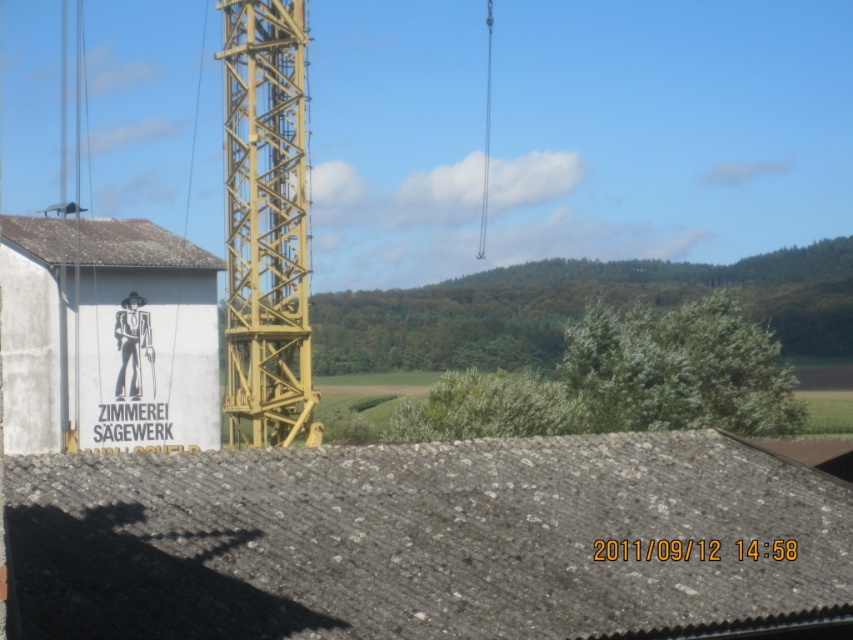
Which is below, gray slate roof at center or yellow metallic crane at center?

gray slate roof at center

Is point (166, 595) less distant than point (280, 122)?

Yes, it is in front of point (280, 122).

Locate an element on the screen. The width and height of the screenshot is (853, 640). gray slate roof at center is located at coordinates (428, 540).

Is white shingle roof at left taller than black matte figure at center?

No, white shingle roof at left is not taller than black matte figure at center.

Identify the location of white shingle roof at left. The image size is (853, 640). (103, 243).

Does yellow metallic crane at center have a smaller size compared to black matte figure at center?

No.

Can you confirm if yellow metallic crane at center is bigger than black matte figure at center?

Yes.

This screenshot has width=853, height=640. What do you see at coordinates (265, 224) in the screenshot?
I see `yellow metallic crane at center` at bounding box center [265, 224].

This screenshot has width=853, height=640. What are the coordinates of `yellow metallic crane at center` in the screenshot? It's located at (265, 224).